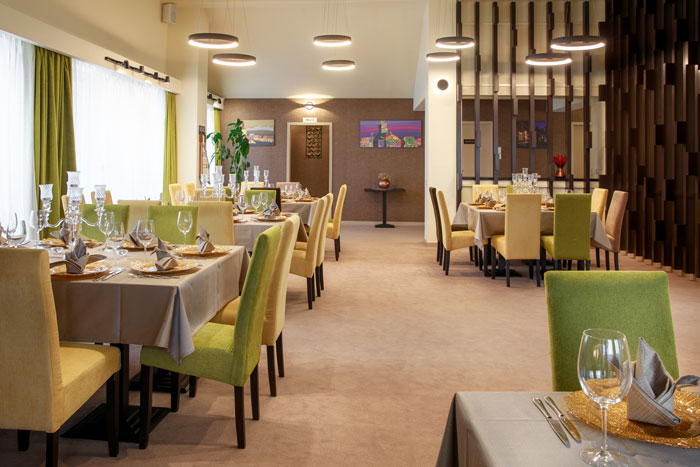
Image resolution: width=700 pixels, height=467 pixels. In order to click on napkins in this screenshot , I will do `click(659, 380)`, `click(209, 246)`, `click(132, 235)`, `click(166, 267)`, `click(85, 262)`, `click(61, 235)`, `click(267, 217)`, `click(488, 202)`, `click(480, 199)`.